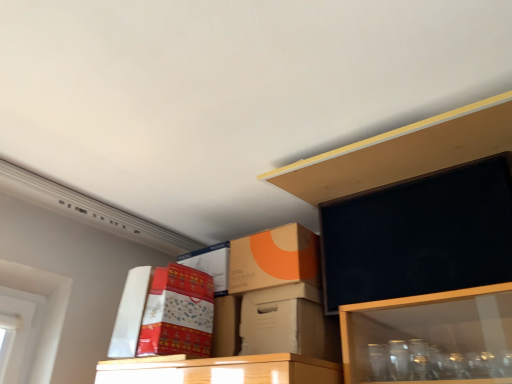
What do you see at coordinates (283, 321) in the screenshot? This screenshot has width=512, height=384. I see `white cardboard box at center, the third box from the left` at bounding box center [283, 321].

What is the approximate height of orange matte cardboard box at upper center, positioned as the second box in right-to-left order?

8.23 inches.

Describe the element at coordinates (273, 259) in the screenshot. I see `orange matte cardboard box at upper center, which is the second box in left-to-right order` at that location.

You are a GUI agent. You are given a task and a screenshot of the screen. Output one action in this format:
    pyautogui.click(x=<x>, y=<y>)
    Task: Click on the white cardboard box at center, the third box from the left
    This screenshot has width=512, height=384.
    Given the screenshot: What is the action you would take?
    pyautogui.click(x=283, y=321)

Considering the relative positions of orange matte cardboard box at upper center, which is the second box in left-to-right order, and white cardboard box at center, which is the 1th box from right to left, in the image provided, is orange matte cardboard box at upper center, which is the second box in left-to-right order, behind white cardboard box at center, which is the 1th box from right to left,?

Yes.

Is orange matte cardboard box at upper center, which is the second box in left-to-right order, next to white cardboard box at center, the third box from the left?

No, orange matte cardboard box at upper center, which is the second box in left-to-right order, is not next to white cardboard box at center, the third box from the left.

Considering the relative sizes of orange matte cardboard box at upper center, which is the second box in left-to-right order, and white cardboard box at center, the third box from the left, in the image provided, is orange matte cardboard box at upper center, which is the second box in left-to-right order, shorter than white cardboard box at center, the third box from the left,?

In fact, orange matte cardboard box at upper center, which is the second box in left-to-right order, may be taller than white cardboard box at center, the third box from the left.

Does point (249, 241) appear closer or farther from the camera than point (308, 351)?

Point (249, 241) is farther from the camera than point (308, 351).

From the image's perspective, is matte cardboard box at upper center positioned above or below white cardboard box at center, the third box from the left?

Clearly, from the image's perspective, matte cardboard box at upper center is above white cardboard box at center, the third box from the left.

Which is in front, point (208, 306) or point (293, 342)?

The point (293, 342) is closer to the camera.

Is matte cardboard box at upper center taller or shorter than white cardboard box at center, the third box from the left?

Clearly, matte cardboard box at upper center is taller compared to white cardboard box at center, the third box from the left.

Is the depth of matte cardboard box at upper center less than that of white cardboard box at center, which is the 1th box from right to left?

Yes.

Is orange matte cardboard box at upper center, positioned as the second box in right-to-left order, at the back of white cardboard box at upper left, which ranks as the 1th box in left-to-right order?

No, white cardboard box at upper left, which ranks as the 1th box in left-to-right order, is not facing the opposite direction of orange matte cardboard box at upper center, positioned as the second box in right-to-left order.

Considering the sizes of white cardboard box at upper left, placed as the 3th box when sorted from right to left, and orange matte cardboard box at upper center, which is the second box in left-to-right order, in the image, is white cardboard box at upper left, placed as the 3th box when sorted from right to left, wider or thinner than orange matte cardboard box at upper center, which is the second box in left-to-right order,?

Considering their sizes, white cardboard box at upper left, placed as the 3th box when sorted from right to left, looks slimmer than orange matte cardboard box at upper center, which is the second box in left-to-right order.

Which point is more distant from viewer, (124, 323) or (308, 264)?

The point (124, 323) is farther from the camera.

Is white cardboard box at upper left, which ranks as the 1th box in left-to-right order, not close to orange matte cardboard box at upper center, positioned as the second box in right-to-left order?

They are positioned close to each other.

From the image's perspective, who appears lower, natural wood shelf at upper center or orange matte cardboard box at upper center, which is the second box in left-to-right order?

orange matte cardboard box at upper center, which is the second box in left-to-right order, from the image's perspective.

Is natural wood shelf at upper center facing towards orange matte cardboard box at upper center, positioned as the second box in right-to-left order?

No, natural wood shelf at upper center is not aimed at orange matte cardboard box at upper center, positioned as the second box in right-to-left order.

Which is closer, (499, 114) or (315, 280)?

The point (499, 114) is in front.

You are a GUI agent. You are given a task and a screenshot of the screen. Output one action in this format:
    pyautogui.click(x=<x>, y=<y>)
    Task: Click on the shelf that is above the orange matte cardboard box at upper center, positioned as the second box in right-to-left order (from the image's perspective)
    This screenshot has width=512, height=384.
    Given the screenshot: What is the action you would take?
    pyautogui.click(x=401, y=153)

From the image's perspective, which is above, orange matte cardboard box at upper center, which is the second box in left-to-right order, or natural wood shelf at upper center?

From the image's view, natural wood shelf at upper center is above.

Could you tell me if orange matte cardboard box at upper center, positioned as the second box in right-to-left order, is facing natural wood shelf at upper center?

No, orange matte cardboard box at upper center, positioned as the second box in right-to-left order, is not oriented towards natural wood shelf at upper center.

Is orange matte cardboard box at upper center, which is the second box in left-to-right order, in front of or behind natural wood shelf at upper center in the image?

Visually, orange matte cardboard box at upper center, which is the second box in left-to-right order, is located behind natural wood shelf at upper center.

Looking at this image, who is smaller, orange matte cardboard box at upper center, which is the second box in left-to-right order, or natural wood shelf at upper center?

orange matte cardboard box at upper center, which is the second box in left-to-right order.

Is natural wood shelf at upper center closer to camera compared to white cardboard box at upper left, which ranks as the 1th box in left-to-right order?

That is True.

Looking at this image, in terms of height, does natural wood shelf at upper center look taller or shorter compared to white cardboard box at upper left, which ranks as the 1th box in left-to-right order?

natural wood shelf at upper center is shorter than white cardboard box at upper left, which ranks as the 1th box in left-to-right order.

From the image's perspective, is natural wood shelf at upper center beneath white cardboard box at upper left, which ranks as the 1th box in left-to-right order?

No.

Is white cardboard box at upper left, which ranks as the 1th box in left-to-right order, surrounded by natural wood shelf at upper center?

Actually, white cardboard box at upper left, which ranks as the 1th box in left-to-right order, is outside natural wood shelf at upper center.

At what (x,y) coordinates should I click in order to perform the action: click on storage box on the left of orange matte cardboard box at upper center, which is the second box in left-to-right order. Please return your answer as a coordinate pair (x, y). The image size is (512, 384). Looking at the image, I should click on (178, 313).

How many degrees apart are the facing directions of matte cardboard box at upper center and orange matte cardboard box at upper center, positioned as the second box in right-to-left order?

The angle between the facing direction of matte cardboard box at upper center and the facing direction of orange matte cardboard box at upper center, positioned as the second box in right-to-left order, is 0.000734 degrees.

Is point (178, 346) closer to camera compared to point (317, 286)?

Yes.

Considering the sizes of objects matte cardboard box at upper center and orange matte cardboard box at upper center, which is the second box in left-to-right order, in the image provided, who is wider, matte cardboard box at upper center or orange matte cardboard box at upper center, which is the second box in left-to-right order,?

matte cardboard box at upper center.

From a real-world perspective, count 2nd boxs upward from the white cardboard box at center, which is the 1th box from right to left, and point to it. Please provide its 2D coordinates.

[(273, 259)]

I want to click on the 2nd box counting from the right side of the matte cardboard box at upper center, so click(283, 321).

Considering their positions, is white cardboard box at upper left, which ranks as the 1th box in left-to-right order, positioned closer to matte cardboard box at upper center than orange matte cardboard box at upper center, positioned as the second box in right-to-left order?

Based on the image, white cardboard box at upper left, which ranks as the 1th box in left-to-right order, appears to be nearer to matte cardboard box at upper center.

Considering their positions, is natural wood shelf at upper center positioned further to matte cardboard box at upper center than orange matte cardboard box at upper center, positioned as the second box in right-to-left order?

Among the two, natural wood shelf at upper center is located further to matte cardboard box at upper center.

Looking at the image, which one is located closer to white cardboard box at center, which is the 1th box from right to left, orange matte cardboard box at upper center, which is the second box in left-to-right order, or matte cardboard box at upper center?

The object closer to white cardboard box at center, which is the 1th box from right to left, is orange matte cardboard box at upper center, which is the second box in left-to-right order.

In the scene shown: Looking at the image, which one is located further to orange matte cardboard box at upper center, which is the second box in left-to-right order, white cardboard box at center, the third box from the left, or matte cardboard box at upper center?

Based on the image, matte cardboard box at upper center appears to be further to orange matte cardboard box at upper center, which is the second box in left-to-right order.

From the image, which object appears to be nearer to white cardboard box at upper left, placed as the 3th box when sorted from right to left, matte cardboard box at upper center or white cardboard box at center, the third box from the left?

The object closer to white cardboard box at upper left, placed as the 3th box when sorted from right to left, is matte cardboard box at upper center.

From the picture: Looking at the image, which one is located closer to matte cardboard box at upper center, white cardboard box at center, which is the 1th box from right to left, or orange matte cardboard box at upper center, positioned as the second box in right-to-left order?

orange matte cardboard box at upper center, positioned as the second box in right-to-left order, is positioned closer to the anchor matte cardboard box at upper center.

When comparing their distances from matte cardboard box at upper center, does natural wood shelf at upper center or white cardboard box at center, the third box from the left, seem closer?

The object closer to matte cardboard box at upper center is white cardboard box at center, the third box from the left.

Which object lies nearer to the anchor point orange matte cardboard box at upper center, positioned as the second box in right-to-left order, natural wood shelf at upper center or matte cardboard box at upper center?

matte cardboard box at upper center is positioned closer to the anchor orange matte cardboard box at upper center, positioned as the second box in right-to-left order.

Where is `box between matte cardboard box at upper center and white cardboard box at center, which is the 1th box from right to left`? The image size is (512, 384). box between matte cardboard box at upper center and white cardboard box at center, which is the 1th box from right to left is located at coordinates (273, 259).

Identify the location of box between white cardboard box at upper left, placed as the 3th box when sorted from right to left, and white cardboard box at center, the third box from the left. (273, 259).

You are a GUI agent. You are given a task and a screenshot of the screen. Output one action in this format:
    pyautogui.click(x=<x>, y=<y>)
    Task: Click on the storage box between white cardboard box at upper left, placed as the 3th box when sorted from right to left, and white cardboard box at center, which is the 1th box from right to left, from left to right
    Image resolution: width=512 pixels, height=384 pixels.
    Given the screenshot: What is the action you would take?
    pyautogui.click(x=178, y=313)

The width and height of the screenshot is (512, 384). I want to click on storage box between white cardboard box at upper left, which ranks as the 1th box in left-to-right order, and orange matte cardboard box at upper center, which is the second box in left-to-right order, from left to right, so [x=178, y=313].